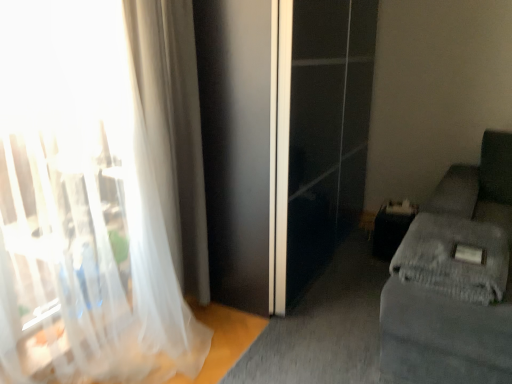
Question: Is white sheer curtain at left, arranged as the 1th curtain when viewed from the front, oriented towards gray fabric couch at right?

Choices:
 (A) yes
 (B) no

Answer: (B)

Question: Does white sheer curtain at left, positioned as the 2th curtain in back-to-front order, come behind gray fabric couch at right?

Choices:
 (A) yes
 (B) no

Answer: (B)

Question: Considering the relative positions of white sheer curtain at left, arranged as the 1th curtain when viewed from the front, and gray fabric couch at right in the image provided, is white sheer curtain at left, arranged as the 1th curtain when viewed from the front, to the left of gray fabric couch at right from the viewer's perspective?

Choices:
 (A) no
 (B) yes

Answer: (B)

Question: Are white sheer curtain at left, positioned as the 2th curtain in back-to-front order, and gray fabric couch at right far apart?

Choices:
 (A) no
 (B) yes

Answer: (B)

Question: Does white sheer curtain at left, positioned as the 2th curtain in back-to-front order, have a lesser width compared to gray fabric couch at right?

Choices:
 (A) yes
 (B) no

Answer: (A)

Question: Does white sheer curtain at left, arranged as the 1th curtain when viewed from the front, have a larger size compared to gray fabric couch at right?

Choices:
 (A) yes
 (B) no

Answer: (B)

Question: Does gray textured blanket at lower right have a greater height compared to gray fabric couch at right?

Choices:
 (A) no
 (B) yes

Answer: (A)

Question: From the image's perspective, is gray textured blanket at lower right over gray fabric couch at right?

Choices:
 (A) no
 (B) yes

Answer: (A)

Question: Is gray textured blanket at lower right aimed at gray fabric couch at right?

Choices:
 (A) yes
 (B) no

Answer: (A)

Question: Is gray textured blanket at lower right positioned before gray fabric couch at right?

Choices:
 (A) yes
 (B) no

Answer: (B)

Question: Is gray textured blanket at lower right positioned with its back to gray fabric couch at right?

Choices:
 (A) yes
 (B) no

Answer: (A)

Question: Is gray textured blanket at lower right not close to gray fabric couch at right?

Choices:
 (A) no
 (B) yes

Answer: (A)

Question: Can translucent fabric curtain at left, which ranks as the 1th curtain in back-to-front order, be found inside white sheer curtain at left, arranged as the 1th curtain when viewed from the front?

Choices:
 (A) no
 (B) yes

Answer: (A)